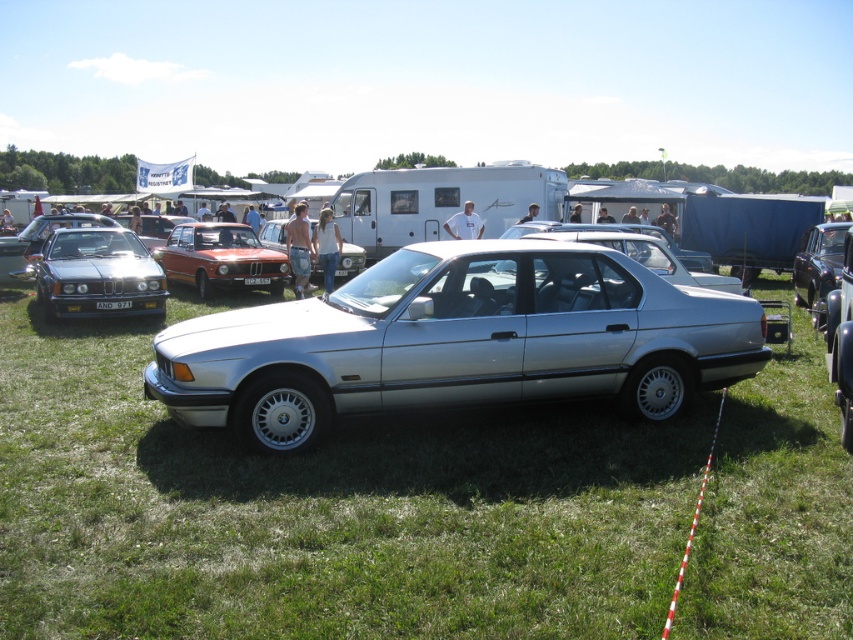
You are at the car show and want to take a photo of both the shiny silver sedan at left and the matte silver sedan at center. Which car should you stand closer to in order to include both in your camera frame?

You should stand closer to the shiny silver sedan at left because it is positioned to the left of the matte silver sedan at center, so moving closer to it would help capture both cars within the frame.

You are a photographer at the car show and need to capture both the shiny silver sedan at left and the matte silver sedan at center in a single frame. Given that your camera can only focus on objects within a 10m distance, will both cars fit within the camera range if they are positioned 8 meters apart from each other?

The shiny silver sedan at left is smaller than the matte silver sedan at center, but since they are positioned 8 meters apart, both are within the 10m camera range. Therefore, they can be captured in a single frame.